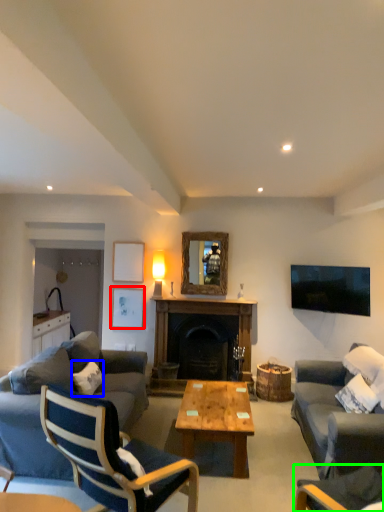
Question: Which is farther away from picture frame (highlighted by a red box)? pillow (highlighted by a blue box) or chair (highlighted by a green box)?

Choices:
 (A) pillow
 (B) chair

Answer: (B)